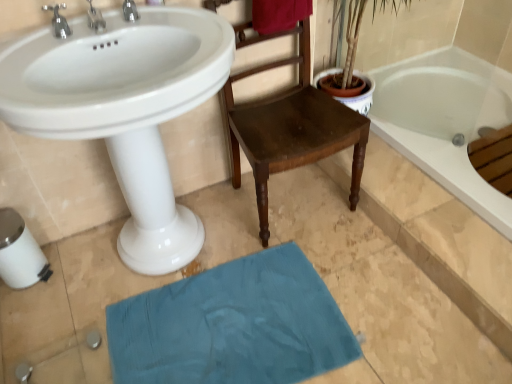
Identify the location of free space that is to the left of silver metallic faucet at upper left, the second tap in the right-to-left sequence. Image resolution: width=512 pixels, height=384 pixels. (42, 47).